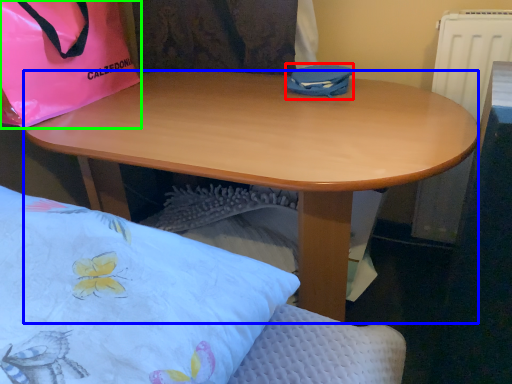
Question: Estimate the real-world distances between objects in this image. Which object is farther from bag (highlighted by a red box), desk (highlighted by a blue box) or handbag (highlighted by a green box)?

Choices:
 (A) desk
 (B) handbag

Answer: (B)